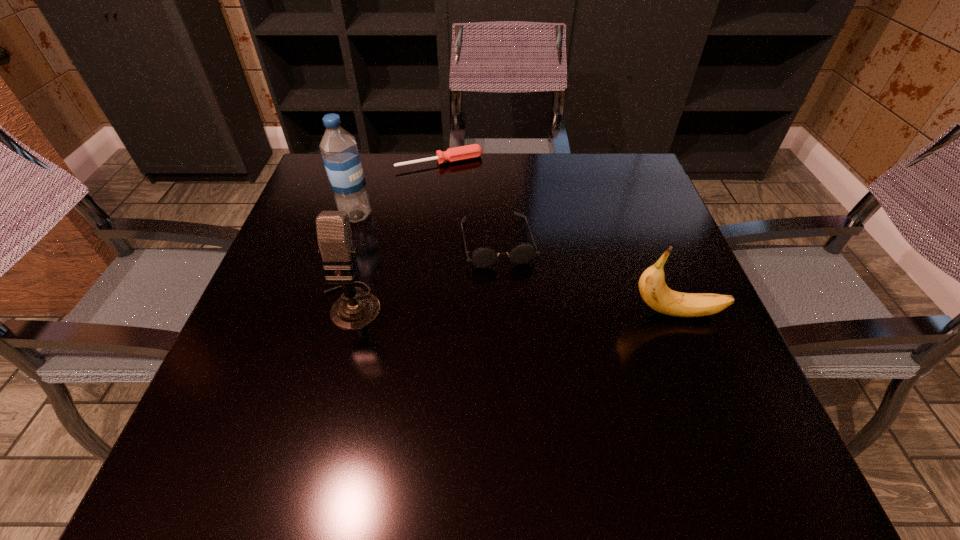
Where is `unoccupied position between the screwdriver and the fourth tallest object`? unoccupied position between the screwdriver and the fourth tallest object is located at coordinates (468, 201).

Identify the location of free space between the rightmost object and the farthest object. (558, 238).

Identify the location of empty space that is in between the microphone and the banana. (514, 309).

The width and height of the screenshot is (960, 540). In order to click on object that is the second closest one to the water bottle in this screenshot , I will do coord(355,309).

Select which object is the closest to the microphone. Please provide its 2D coordinates. Your answer should be formatted as a tuple, i.e. [(x, y)], where the tuple contains the x and y coordinates of a point satisfying the conditions above.

[(482, 257)]

The height and width of the screenshot is (540, 960). In order to click on blank area in the image that satisfies the following two spatial constraints: 1. on the front-facing side of the rightmost object; 2. at the start of the peel on the microphone in this screenshot , I will do click(348, 313).

Find the location of `vacant area that satisfies the following two spatial constraints: 1. on the front side of the second shortest object; 2. at the start of the peel on the banana`. vacant area that satisfies the following two spatial constraints: 1. on the front side of the second shortest object; 2. at the start of the peel on the banana is located at coordinates pos(501,313).

This screenshot has height=540, width=960. What are the coordinates of `free space that satisfies the following two spatial constraints: 1. on the front side of the water bottle; 2. on the right side of the sunglasses` in the screenshot? It's located at (348, 241).

Where is `blank space that satisfies the following two spatial constraints: 1. on the front side of the sunglasses; 2. on the right side of the water bottle`? blank space that satisfies the following two spatial constraints: 1. on the front side of the sunglasses; 2. on the right side of the water bottle is located at coordinates (348, 241).